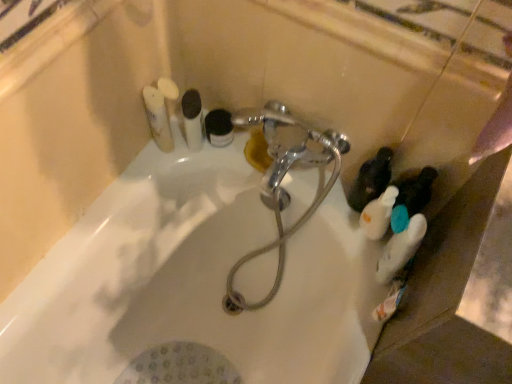
Locate an element on the screen. This screenshot has height=384, width=512. free spot to the left of black matte jar at upper center, the 4th toiletry from the left is located at coordinates (161, 167).